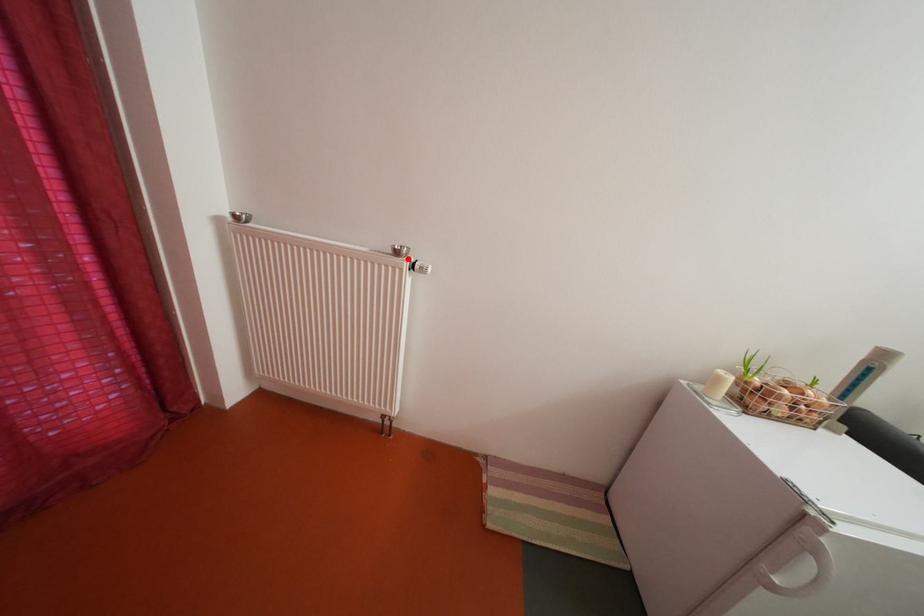
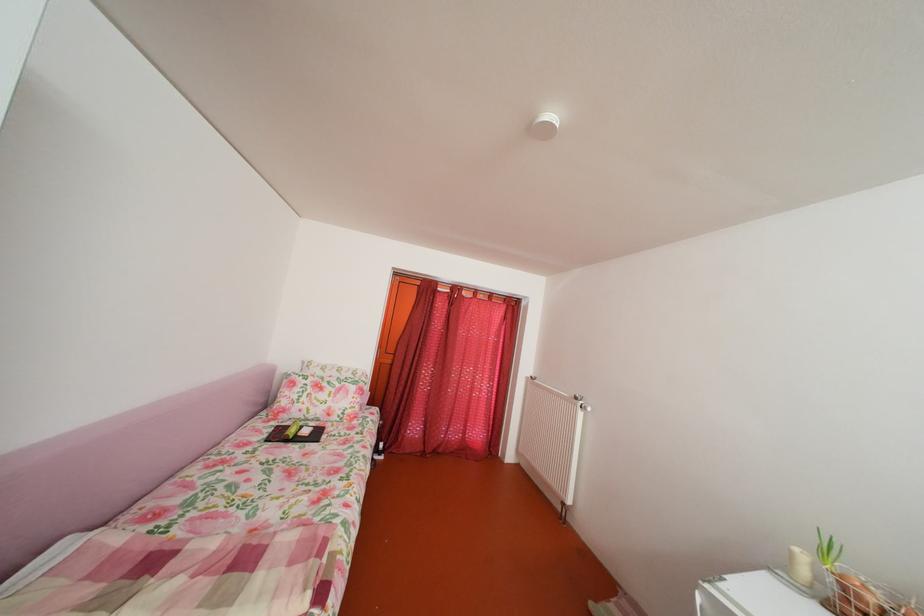
In the second image, find the point that corresponds to the highlighted location in the first image.

(588, 405)